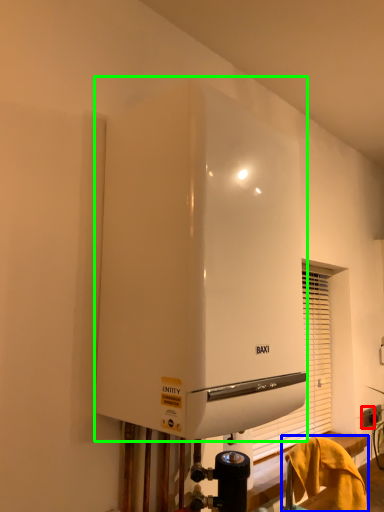
Question: Based on their relative distances, which object is nearer to electric outlet (highlighted by a red box)? Choose from furniture (highlighted by a blue box) and home appliance (highlighted by a green box).

Choices:
 (A) furniture
 (B) home appliance

Answer: (A)